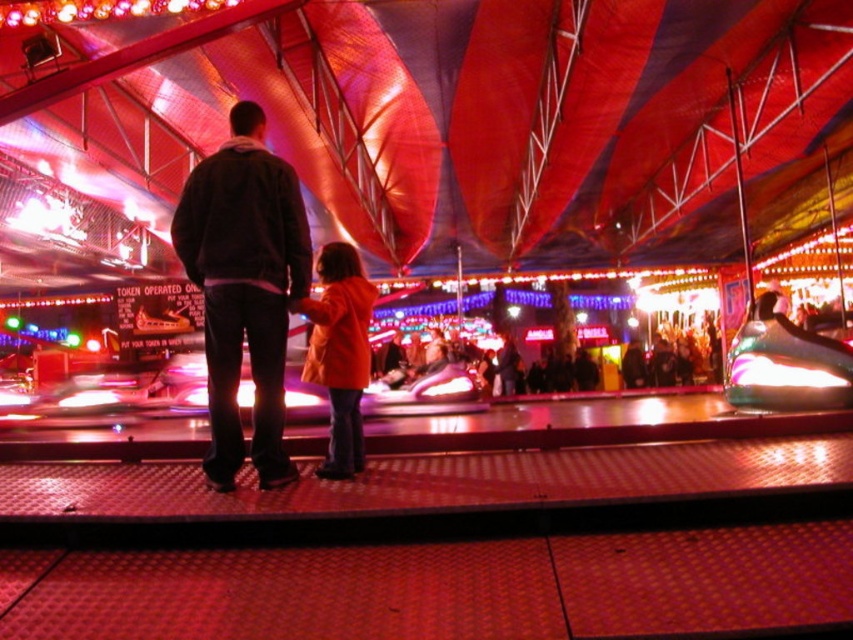
Question: Can you confirm if dark gray hoodie at center is thinner than orange matte coat at center?

Choices:
 (A) yes
 (B) no

Answer: (B)

Question: Which point is farther to the camera?

Choices:
 (A) dark gray hoodie at center
 (B) orange matte coat at center

Answer: (B)

Question: Can you confirm if dark gray hoodie at center is thinner than orange matte coat at center?

Choices:
 (A) no
 (B) yes

Answer: (A)

Question: Which object is closer to the camera taking this photo?

Choices:
 (A) dark gray hoodie at center
 (B) orange matte coat at center

Answer: (A)

Question: Which point appears farthest from the camera in this image?

Choices:
 (A) (303, 236)
 (B) (305, 358)

Answer: (B)

Question: From the image, what is the correct spatial relationship of dark gray hoodie at center in relation to orange matte coat at center?

Choices:
 (A) right
 (B) left

Answer: (B)